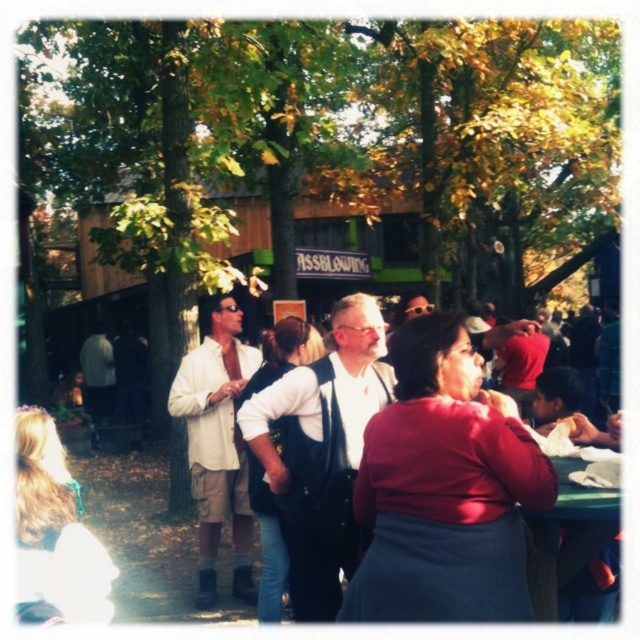
Question: Where is blonde hair at center located in relation to matte black vest at center in the image?

Choices:
 (A) above
 (B) below

Answer: (B)

Question: Which point is farther from the camera taking this photo?

Choices:
 (A) (221, 378)
 (B) (486, 147)
 (C) (534, 324)

Answer: (B)

Question: Does green leafy tree at center come behind white cotton shirt at center?

Choices:
 (A) yes
 (B) no

Answer: (A)

Question: Which point appears closest to the camera in this image?

Choices:
 (A) (104, 572)
 (B) (502, 342)
 (C) (288, 484)

Answer: (A)

Question: Can you confirm if green leafy tree at center is positioned below matte red shirt at center?

Choices:
 (A) no
 (B) yes

Answer: (A)

Question: Which object is closer to the camera taking this photo?

Choices:
 (A) blonde hair at center
 (B) white shirt at center

Answer: (A)